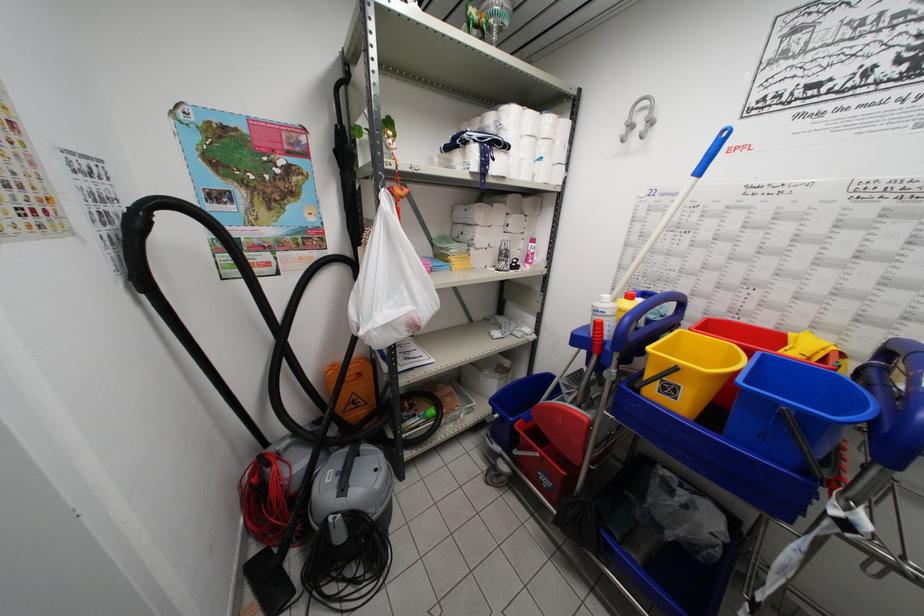
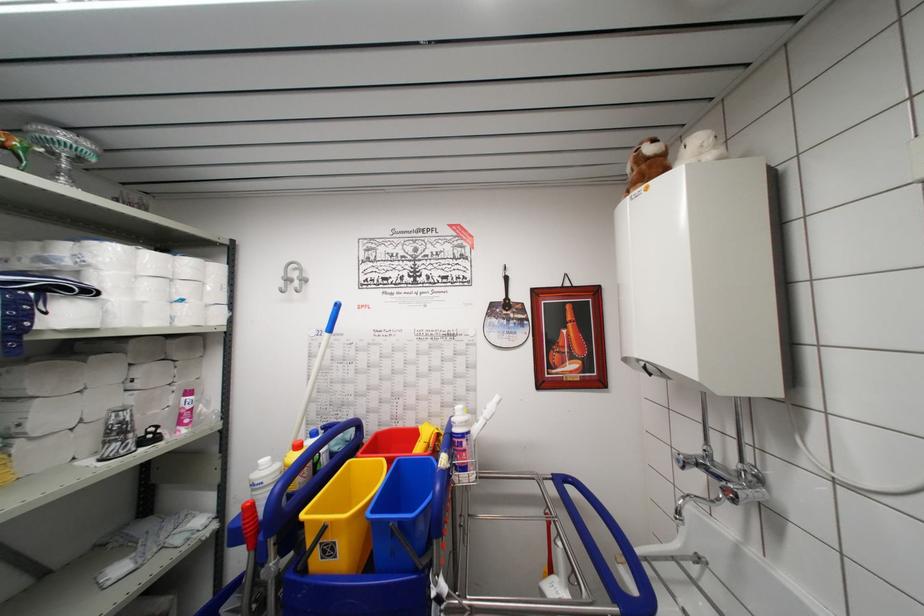
The point at [684,315] is marked in the first image. Where is the corresponding point in the second image?

(361, 439)